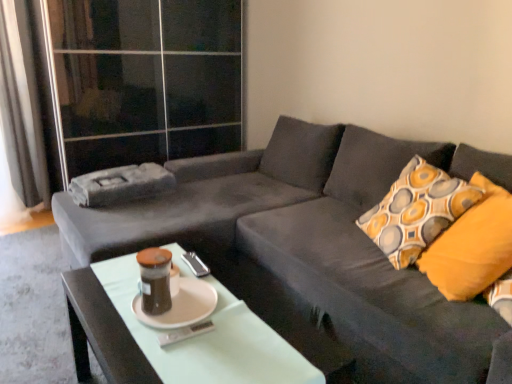
Find the location of a particular element. The height and width of the screenshot is (384, 512). empty space that is ontop of white glossy coffee table at center is located at coordinates (186, 311).